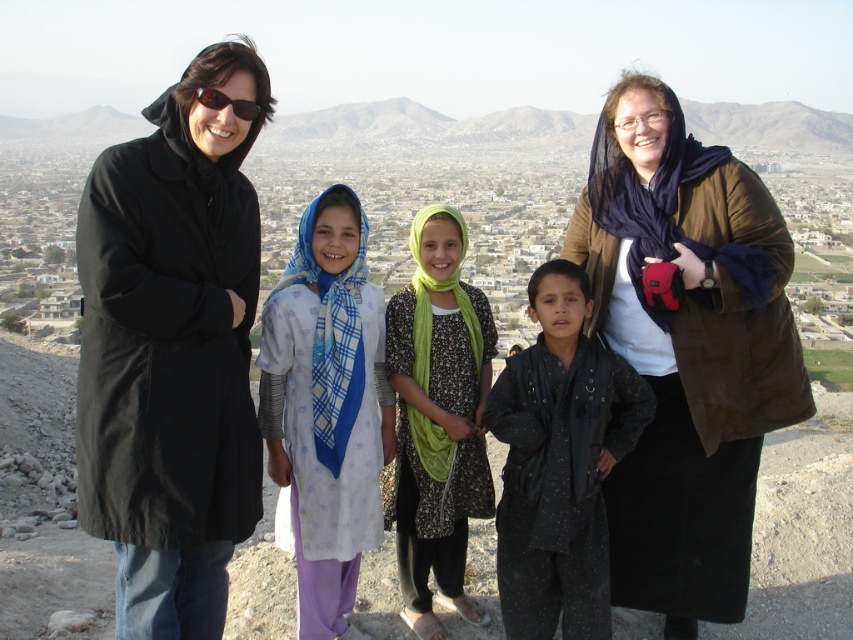
Where is the light purple fabric dress at center located in the image?

The light purple fabric dress at center is located at point (326, 408).

You are a photographer taking a group photo of the two adults and three children on a hilltop overlooking a city. You notice the light purple fabric dress at center and the black textured jacket at center. Which clothing item would appear bigger in the photo?

The light purple fabric dress at center would appear bigger in the photo because it is larger in size than the black textured jacket at center.

You are a photographer trying to capture a group photo of the black fabric coat at left and the brown suede jacket at upper right. If you want to ensure both coats are fully visible in the frame, which one should you focus on to avoid cropping either?

You should focus on the brown suede jacket at upper right because it is wider than the black fabric coat at left, so ensuring it fits will accommodate the narrower coat as well.